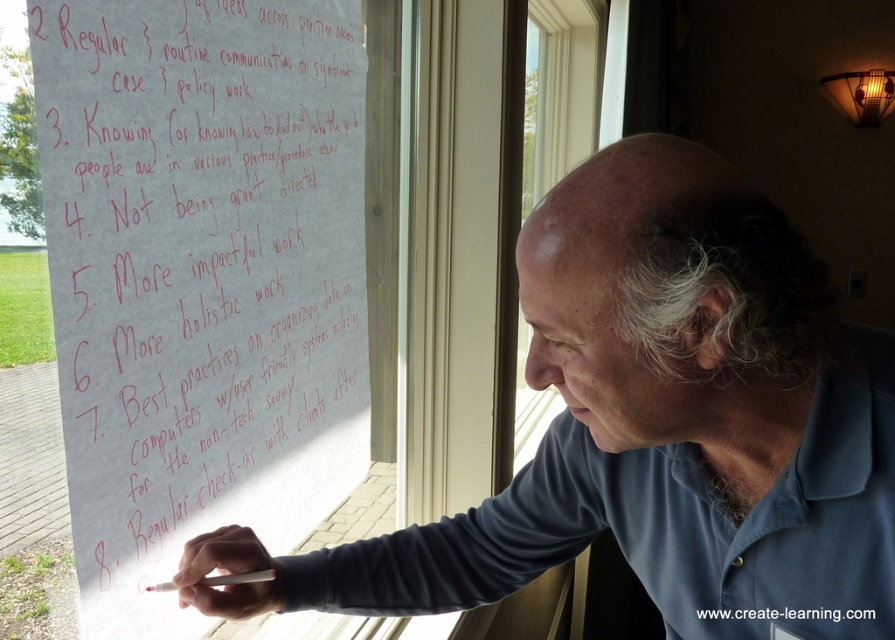
You are a photographer taking a picture of the whiteboard. The whiteboard has two points marked as point 1 at (729, 564) and point 2 at (540, 108). Which point will appear larger in your photo?

Point 1 at (729, 564) will appear larger in the photo because it is closer to the camera than point 2 at (540, 108).